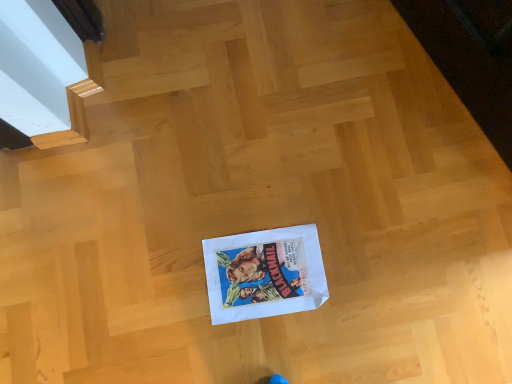
At what (x,y) coordinates should I click in order to perform the action: click on free point above white paper flyer at center (from a real-world perspective). Please return your answer as a coordinate pair (x, y). Looking at the image, I should click on (268, 277).